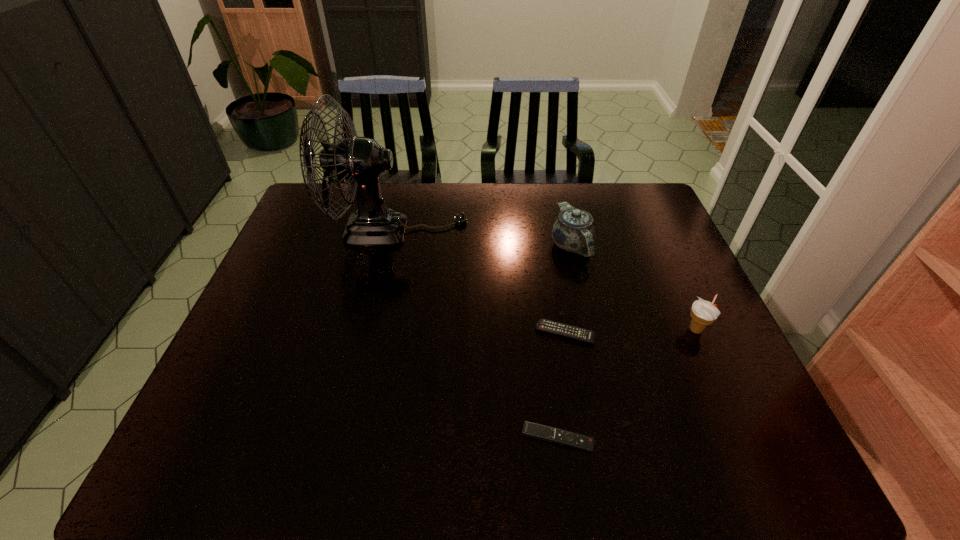
Identify the location of vacant space located 0.100m on the right of the nearer remote control. Image resolution: width=960 pixels, height=540 pixels. (641, 438).

Where is `object present at the far edge`? This screenshot has height=540, width=960. object present at the far edge is located at coordinates (360, 160).

Identify the location of object that is at the near edge. (538, 431).

What are the coordinates of `object positioned at the left edge` in the screenshot? It's located at (360, 160).

Where is `object situated at the right edge`? object situated at the right edge is located at coordinates pos(703,313).

In order to click on object at the far left corner in this screenshot , I will do `click(360, 160)`.

Find the location of a particular element. free location at the far edge is located at coordinates (603, 189).

Locate an element on the screen. This screenshot has width=960, height=540. free space at the near edge of the desktop is located at coordinates (658, 475).

Where is `free region at the left edge of the desktop`? free region at the left edge of the desktop is located at coordinates (277, 280).

In the image, there is a desktop. At what (x,y) coordinates should I click in order to perform the action: click on free space at the right edge. Please return your answer as a coordinate pair (x, y). Looking at the image, I should click on (723, 426).